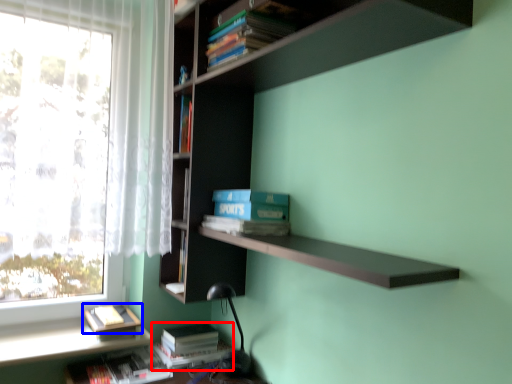
Question: Which of the following is the farthest to the observer, book (highlighted by a red box) or book (highlighted by a blue box)?

Choices:
 (A) book
 (B) book

Answer: (A)